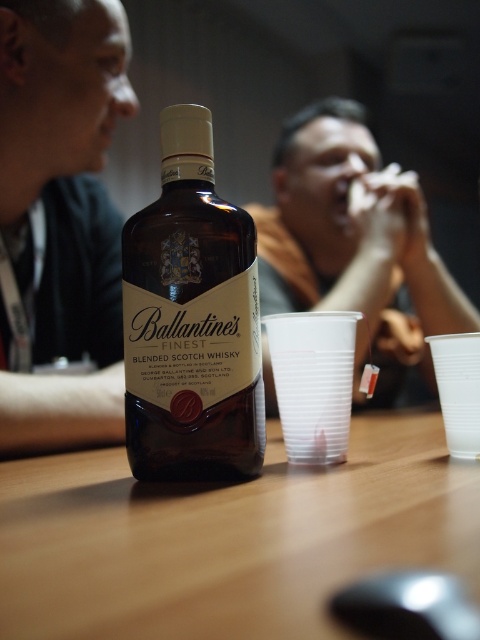
Question: Which of the following is the farthest from the observer?

Choices:
 (A) (380, 609)
 (B) (298, 602)
 (C) (345, 323)

Answer: (C)

Question: Is smooth skin face at upper left wider than transparent plastic cup at center?

Choices:
 (A) no
 (B) yes

Answer: (B)

Question: Which of these objects is positioned closest to the orange cotton shirt at center?

Choices:
 (A) transparent plastic cup at center
 (B) brown wooden table at center
 (C) black plastic mouse at lower center
 (D) transparent plastic cup at lower right

Answer: (B)

Question: Is smooth skin face at upper left above transparent plastic cup at lower right?

Choices:
 (A) yes
 (B) no

Answer: (A)

Question: Based on their relative distances, which object is farther from the brown wooden table at center?

Choices:
 (A) smooth skin face at upper left
 (B) transparent plastic cup at center
 (C) brown glass bottle at center
 (D) black plastic mouse at lower center

Answer: (A)

Question: Can you confirm if brown glass bottle at center is positioned above orange cotton shirt at center?

Choices:
 (A) no
 (B) yes

Answer: (A)